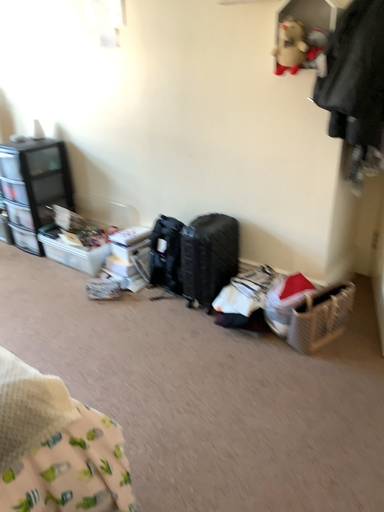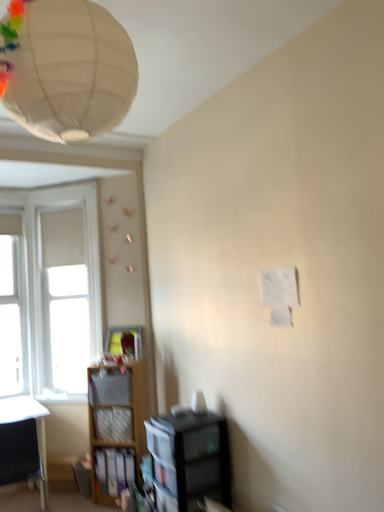
Question: How did the camera likely rotate when shooting the video?

Choices:
 (A) rotated upward
 (B) rotated downward

Answer: (A)